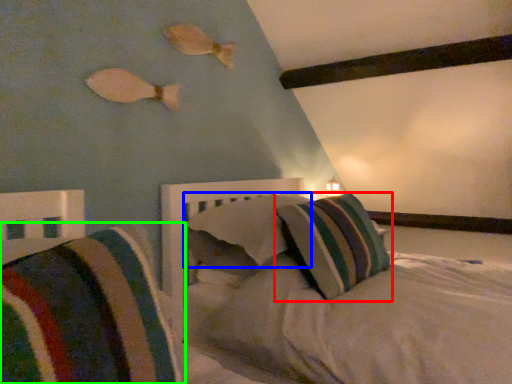
Question: Considering the real-world distances, which object is farthest from pillow (highlighted by a red box)? pillow (highlighted by a blue box) or pillow (highlighted by a green box)?

Choices:
 (A) pillow
 (B) pillow

Answer: (B)